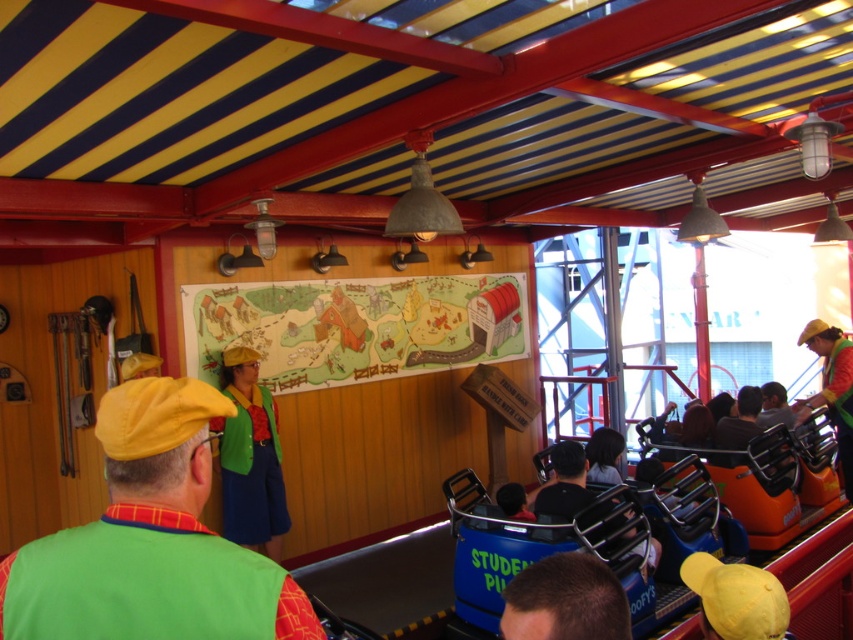
Consider the image. Which is below, matte green vest at center or dark brown hair at lower center?

matte green vest at center is below.

What do you see at coordinates (250, 458) in the screenshot?
I see `matte green vest at center` at bounding box center [250, 458].

Between point (270, 483) and point (500, 621), which one is positioned behind?

Point (270, 483)

This screenshot has height=640, width=853. Find the location of `matte green vest at center`. matte green vest at center is located at coordinates (250, 458).

Consider the image. Which of these two, green fabric vest at center or dark brown hair at lower center, stands taller?

With more height is green fabric vest at center.

Can you confirm if green fabric vest at center is thinner than dark brown hair at lower center?

In fact, green fabric vest at center might be wider than dark brown hair at lower center.

Does point (167, 416) come closer to viewer compared to point (517, 592)?

No.

Where is `green fabric vest at center`? green fabric vest at center is located at coordinates (151, 540).

Can you confirm if green fabric vest at center is positioned to the right of matte green vest at center?

Indeed, green fabric vest at center is positioned on the right side of matte green vest at center.

This screenshot has width=853, height=640. What do you see at coordinates (151, 540) in the screenshot?
I see `green fabric vest at center` at bounding box center [151, 540].

Does point (218, 540) come closer to viewer compared to point (277, 502)?

Yes, point (218, 540) is in front of point (277, 502).

I want to click on green fabric vest at center, so click(151, 540).